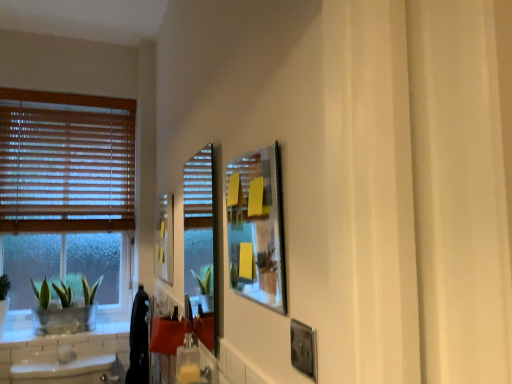
Question: Considering the relative sizes of clear glass screen door at center and metallic silver picture frame at lower right, the 1th picture frame from the right, in the image provided, is clear glass screen door at center smaller than metallic silver picture frame at lower right, the 1th picture frame from the right,?

Choices:
 (A) no
 (B) yes

Answer: (A)

Question: From a real-world perspective, is clear glass screen door at center positioned over metallic silver picture frame at lower right, which is the third picture frame from left to right, based on gravity?

Choices:
 (A) yes
 (B) no

Answer: (A)

Question: Could metallic silver picture frame at lower right, the 1th picture frame from the right, be considered to be inside clear glass screen door at center?

Choices:
 (A) no
 (B) yes

Answer: (A)

Question: Is clear glass screen door at center bigger than metallic silver picture frame at lower right, the 1th picture frame from the right?

Choices:
 (A) yes
 (B) no

Answer: (A)

Question: Is clear glass screen door at center oriented towards metallic silver picture frame at lower right, the 3th picture frame viewed from the back?

Choices:
 (A) no
 (B) yes

Answer: (A)

Question: Looking at their shapes, would you say clear glass screen door at center is wider or thinner than black fabric laundry at lower left?

Choices:
 (A) wide
 (B) thin

Answer: (B)

Question: Choose the correct answer: Is clear glass screen door at center inside black fabric laundry at lower left or outside it?

Choices:
 (A) inside
 (B) outside

Answer: (B)

Question: From the image's perspective, is clear glass screen door at center positioned above or below black fabric laundry at lower left?

Choices:
 (A) below
 (B) above

Answer: (B)

Question: Is point (184, 223) positioned closer to the camera than point (139, 322)?

Choices:
 (A) farther
 (B) closer

Answer: (A)

Question: From the image's perspective, is clear glass screen door at center above or below metallic silver picture frame at upper center, which is the second picture frame in front-to-back order?

Choices:
 (A) above
 (B) below

Answer: (B)

Question: From their relative heights in the image, would you say clear glass screen door at center is taller or shorter than metallic silver picture frame at upper center, placed as the second picture frame when sorted from right to left?

Choices:
 (A) tall
 (B) short

Answer: (A)

Question: Which is correct: clear glass screen door at center is inside metallic silver picture frame at upper center, acting as the second picture frame starting from the back, or outside of it?

Choices:
 (A) inside
 (B) outside

Answer: (B)

Question: From a real-world perspective, is clear glass screen door at center physically located above or below metallic silver picture frame at upper center, the second picture frame when ordered from left to right?

Choices:
 (A) above
 (B) below

Answer: (B)

Question: Is matte yellow picture frame at upper left, the 3th picture frame from the right, wider or thinner than black fabric laundry at lower left?

Choices:
 (A) wide
 (B) thin

Answer: (B)

Question: In the image, is matte yellow picture frame at upper left, which is counted as the third picture frame, starting from the front, on the left side or the right side of black fabric laundry at lower left?

Choices:
 (A) right
 (B) left

Answer: (A)